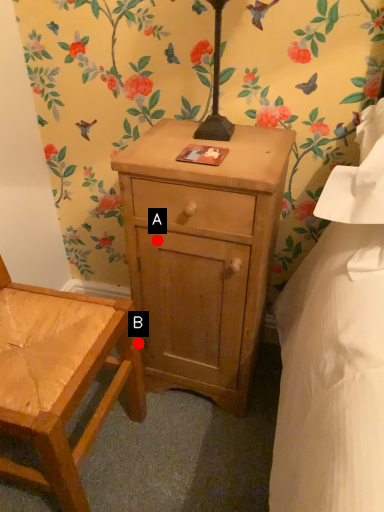
Question: Two points are circled on the image, labeled by A and B beside each circle. Among these points, which one is nearest to the camera?

Choices:
 (A) A is closer
 (B) B is closer

Answer: (A)